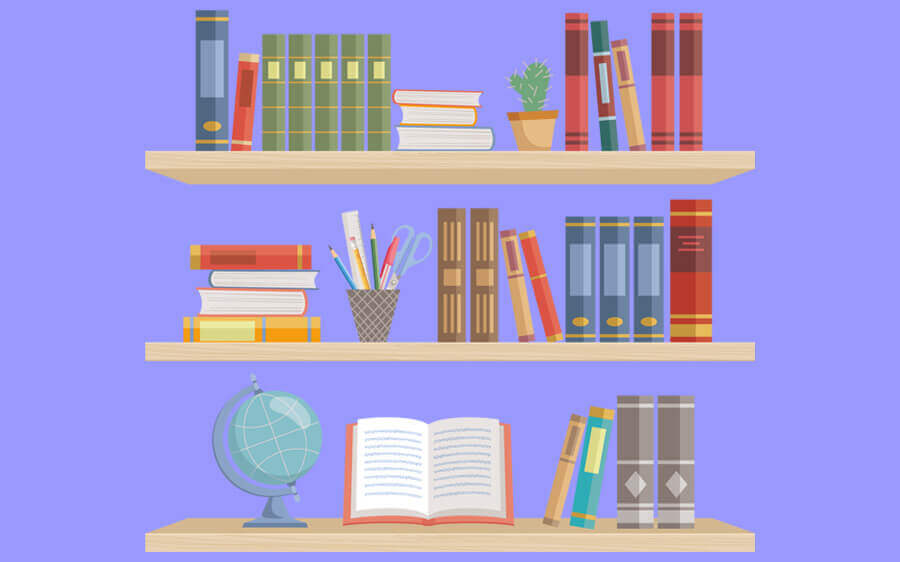
The height and width of the screenshot is (562, 900). Find the location of `green books on top shelf`. green books on top shelf is located at coordinates (272, 88), (294, 92), (327, 99), (352, 101), (381, 99).